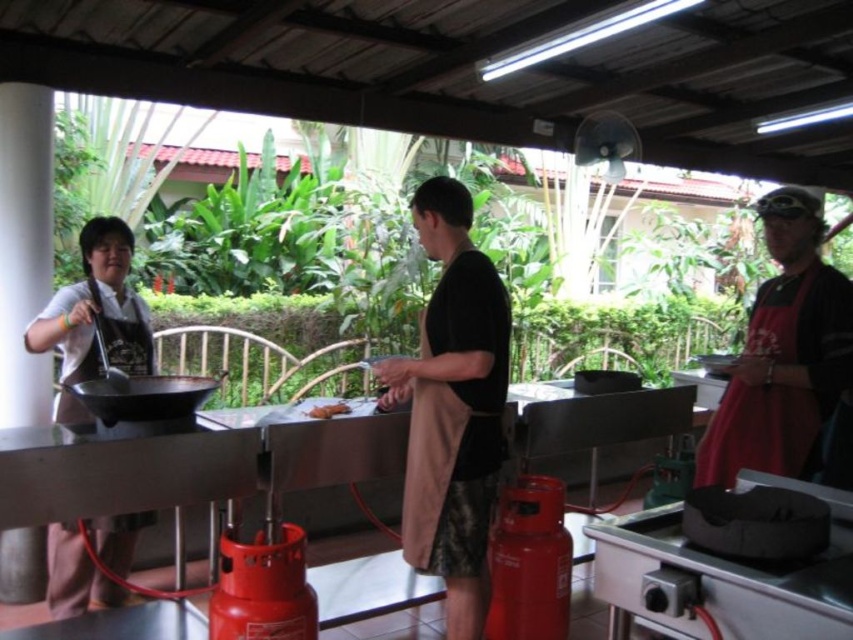
Question: Which point is farther to the camera?

Choices:
 (A) black matte wok at left
 (B) black matte apron at center
 (C) red matte gas canister at lower center
 (D) brown matte bread at center

Answer: (D)

Question: Is red matte gas canister at lower center positioned behind black matte wok at left?

Choices:
 (A) yes
 (B) no

Answer: (A)

Question: Does red matte gas canister at lower center appear on the left side of brown matte bread at center?

Choices:
 (A) yes
 (B) no

Answer: (B)

Question: Estimate the real-world distances between objects in this image. Which object is closer to the red fabric shirt at right?

Choices:
 (A) black matte apron at center
 (B) black matte wok at left

Answer: (A)

Question: Which object is farther from the camera taking this photo?

Choices:
 (A) black matte apron at center
 (B) red fabric shirt at right
 (C) black matte wok at left

Answer: (B)

Question: In this image, where is black matte wok at left located relative to brown matte bread at center?

Choices:
 (A) above
 (B) below

Answer: (A)